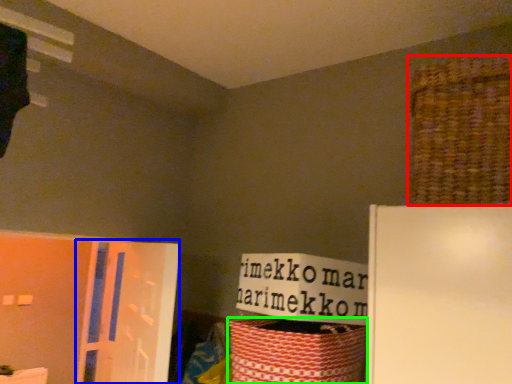
Question: Which is farther away from basket (highlighted by a red box)? screen door (highlighted by a blue box) or basket (highlighted by a green box)?

Choices:
 (A) screen door
 (B) basket

Answer: (A)